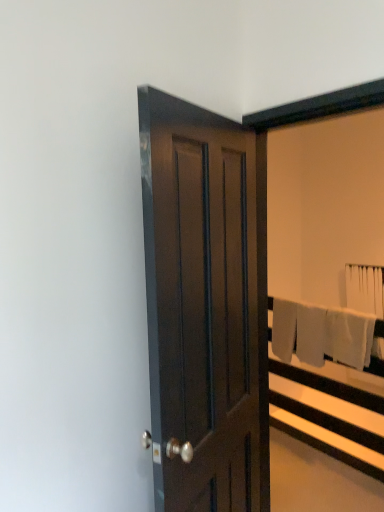
Question: From the image's perspective, does white fabric bed frame at right appear lower than dark wood door at center?

Choices:
 (A) yes
 (B) no

Answer: (A)

Question: Is white fabric bed frame at right not near dark wood door at center?

Choices:
 (A) no
 (B) yes

Answer: (B)

Question: From a real-world perspective, does white fabric bed frame at right stand above dark wood door at center?

Choices:
 (A) yes
 (B) no

Answer: (B)

Question: Does white fabric bed frame at right touch dark wood door at center?

Choices:
 (A) yes
 (B) no

Answer: (B)

Question: From the image's perspective, is white fabric bed frame at right over dark wood door at center?

Choices:
 (A) yes
 (B) no

Answer: (B)

Question: Is dark wood door at center in front of or behind white fabric bed frame at right in the image?

Choices:
 (A) front
 (B) behind

Answer: (A)

Question: Looking at their shapes, would you say dark wood door at center is wider or thinner than white fabric bed frame at right?

Choices:
 (A) wide
 (B) thin

Answer: (B)

Question: Is point (177, 348) closer or farther from the camera than point (340, 379)?

Choices:
 (A) farther
 (B) closer

Answer: (B)

Question: Considering the positions of dark wood door at center and white fabric bed frame at right in the image, is dark wood door at center taller or shorter than white fabric bed frame at right?

Choices:
 (A) short
 (B) tall

Answer: (B)

Question: Is white cotton bath towel at right, marked as the 2th bath towel in a top-to-bottom arrangement, bigger or smaller than white fabric bed frame at right?

Choices:
 (A) small
 (B) big

Answer: (A)

Question: From a real-world perspective, is white cotton bath towel at right, acting as the 2th bath towel starting from the right, physically located above or below white fabric bed frame at right?

Choices:
 (A) above
 (B) below

Answer: (A)

Question: Considering the relative positions of white cotton bath towel at right, positioned as the 1th bath towel in bottom-to-top order, and white fabric bed frame at right in the image provided, is white cotton bath towel at right, positioned as the 1th bath towel in bottom-to-top order, to the left or to the right of white fabric bed frame at right?

Choices:
 (A) left
 (B) right

Answer: (A)

Question: Considering the positions of white cotton bath towel at right, which is the second bath towel in back-to-front order, and white fabric bed frame at right in the image, is white cotton bath towel at right, which is the second bath towel in back-to-front order, taller or shorter than white fabric bed frame at right?

Choices:
 (A) short
 (B) tall

Answer: (A)

Question: Is dark wood door at center in front of or behind white fabric bath towel at upper right, arranged as the 2th bath towel when viewed from the front, in the image?

Choices:
 (A) behind
 (B) front

Answer: (B)

Question: Looking at their shapes, would you say dark wood door at center is wider or thinner than white fabric bath towel at upper right, which appears as the second bath towel when viewed from the left?

Choices:
 (A) wide
 (B) thin

Answer: (A)